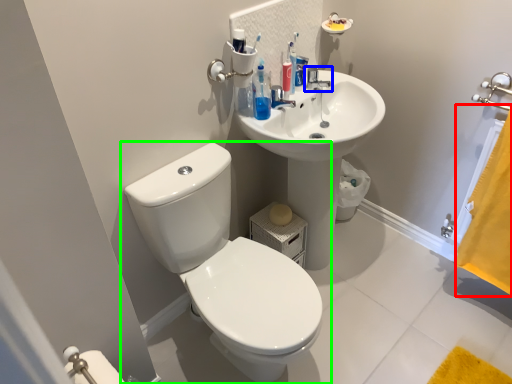
Question: Which object is the closest to the curtain (highlighted by a red box)? Choose among these: tap (highlighted by a blue box) or toilet (highlighted by a green box).

Choices:
 (A) tap
 (B) toilet

Answer: (A)